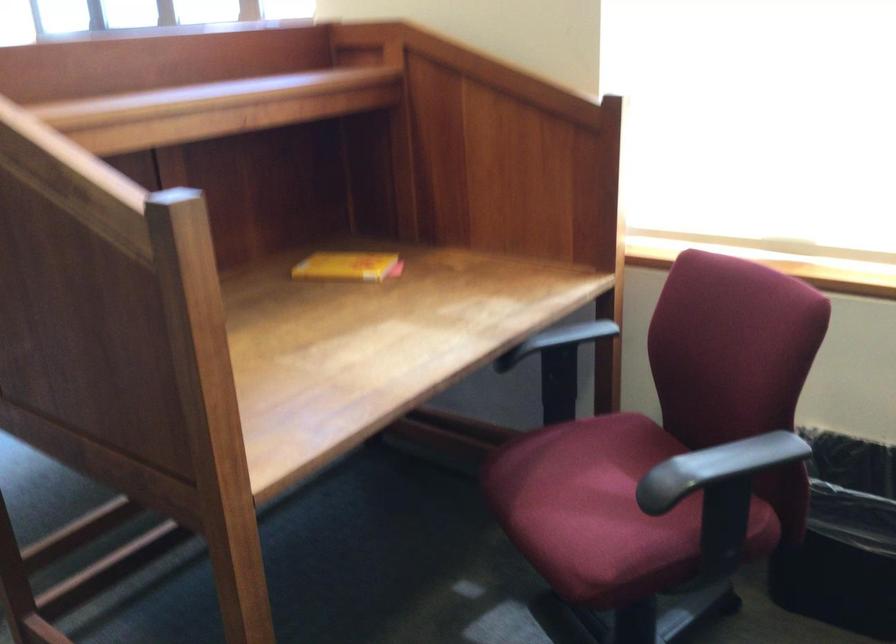
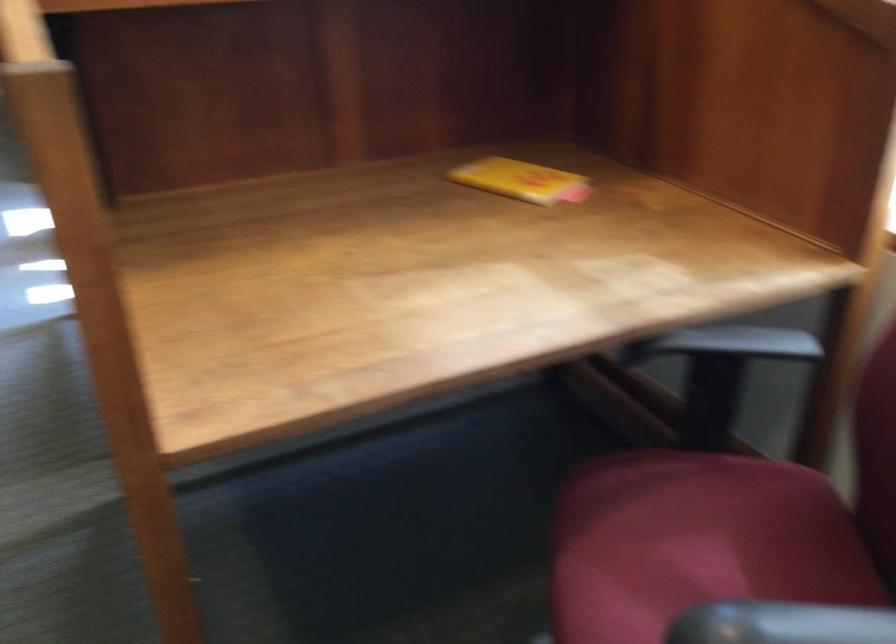
Locate, in the second image, the point that corresponds to pixel 601 482 in the first image.

(694, 554)